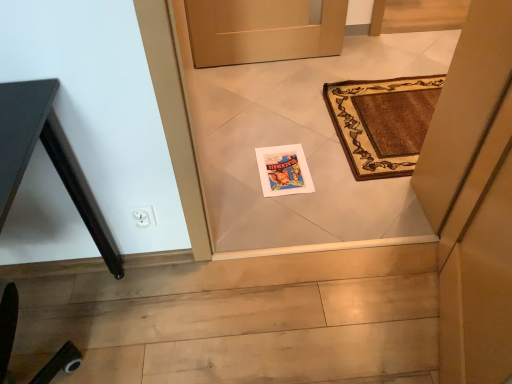
Question: In terms of width, does matte paper postcard at center look wider or thinner when compared to black matte table at left?

Choices:
 (A) thin
 (B) wide

Answer: (A)

Question: Is matte paper postcard at center spatially inside black matte table at left, or outside of it?

Choices:
 (A) outside
 (B) inside

Answer: (A)

Question: From a real-world perspective, is matte paper postcard at center above or below black matte table at left?

Choices:
 (A) above
 (B) below

Answer: (B)

Question: From a real-world perspective, relative to matte paper postcard at center, is black matte table at left vertically above or below?

Choices:
 (A) below
 (B) above

Answer: (B)

Question: Relative to matte paper postcard at center, is black matte table at left in front or behind?

Choices:
 (A) front
 (B) behind

Answer: (A)

Question: Considering the positions of black matte table at left and matte paper postcard at center in the image, is black matte table at left wider or thinner than matte paper postcard at center?

Choices:
 (A) wide
 (B) thin

Answer: (A)

Question: From the image's perspective, is black matte table at left above or below matte paper postcard at center?

Choices:
 (A) below
 (B) above

Answer: (A)